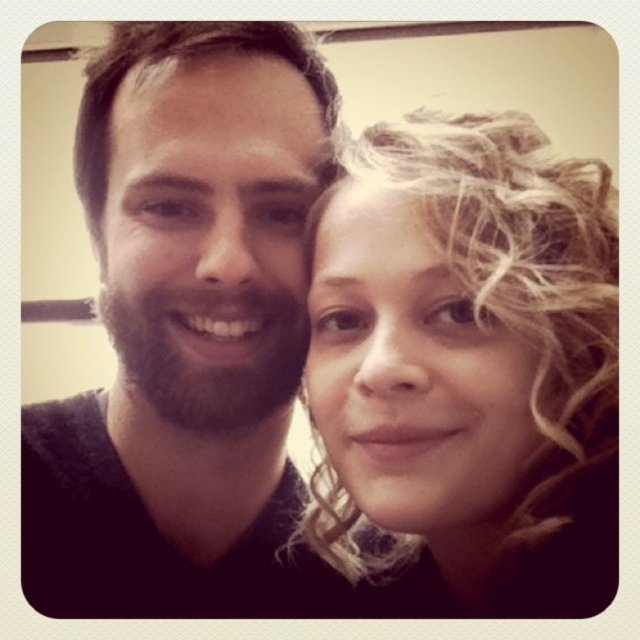
Question: Is dark brown hair at left smaller than dark brown curly hair at upper left?

Choices:
 (A) yes
 (B) no

Answer: (B)

Question: Does blonde curly hair at right appear over dark brown curly hair at upper left?

Choices:
 (A) yes
 (B) no

Answer: (B)

Question: Does dark brown hair at left have a smaller size compared to blonde curly hair at right?

Choices:
 (A) no
 (B) yes

Answer: (A)

Question: Which is farther from the dark brown hair at left?

Choices:
 (A) blonde curly hair at right
 (B) dark brown curly hair at upper left

Answer: (A)

Question: Among these objects, which one is farthest from the camera?

Choices:
 (A) dark brown hair at left
 (B) dark brown curly hair at upper left
 (C) blonde curly hair at right

Answer: (B)

Question: Which is farther from the dark brown curly hair at upper left?

Choices:
 (A) dark brown hair at left
 (B) blonde curly hair at right

Answer: (B)